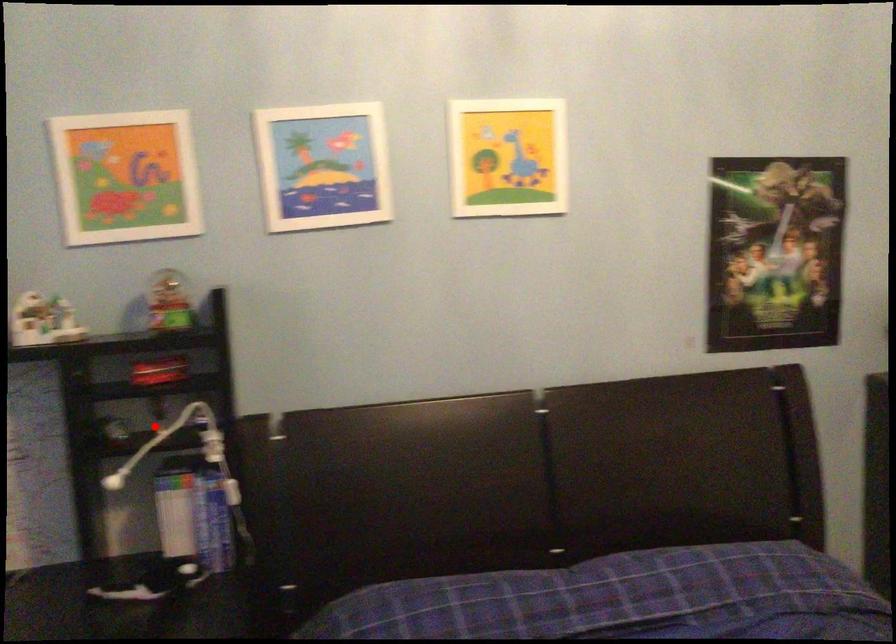
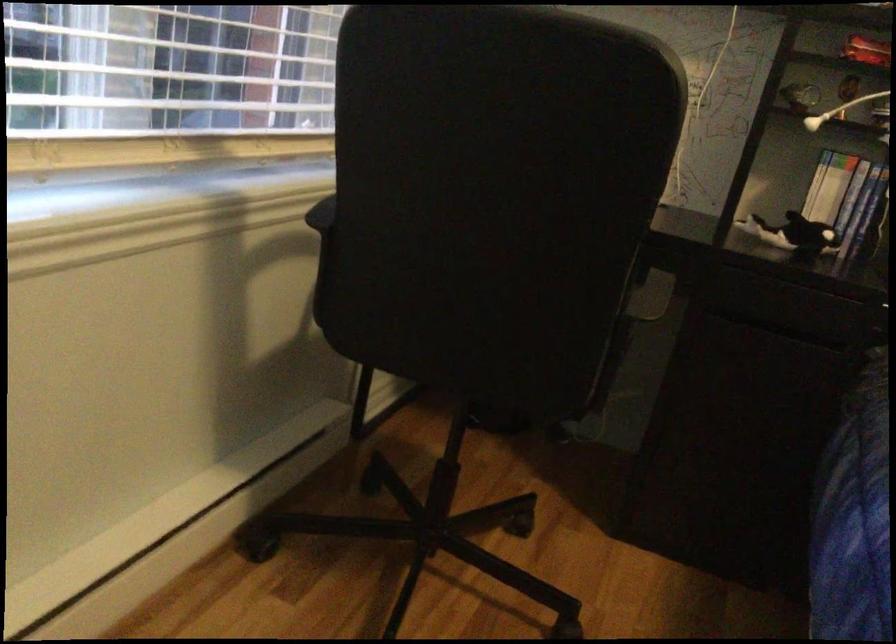
Find the pixel in the second image that matches the highlighted location in the first image.

(839, 109)